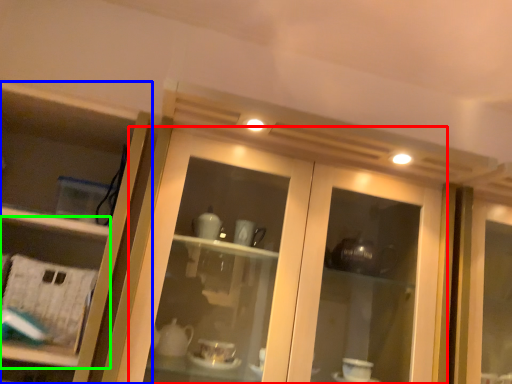
Question: Based on their relative distances, which object is farther from door (highlighted by a red box)? Choose from cupboard (highlighted by a blue box) and shelf (highlighted by a green box).

Choices:
 (A) cupboard
 (B) shelf

Answer: (B)